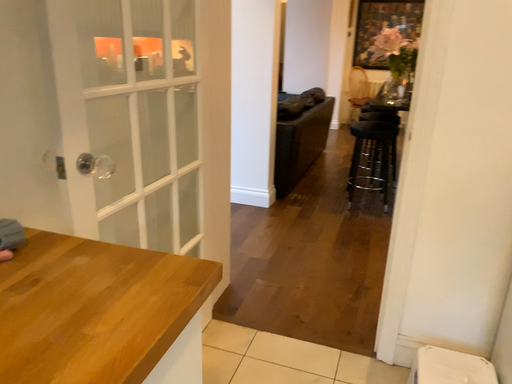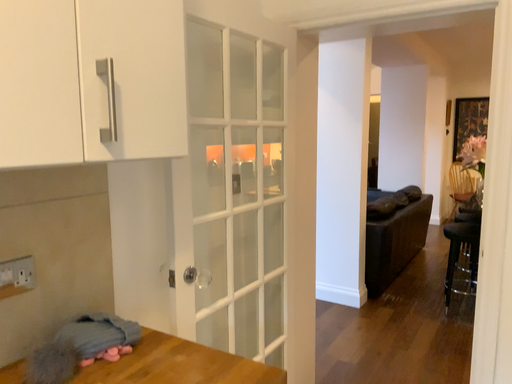
Question: How did the camera likely rotate when shooting the video?

Choices:
 (A) rotated left
 (B) rotated right

Answer: (A)